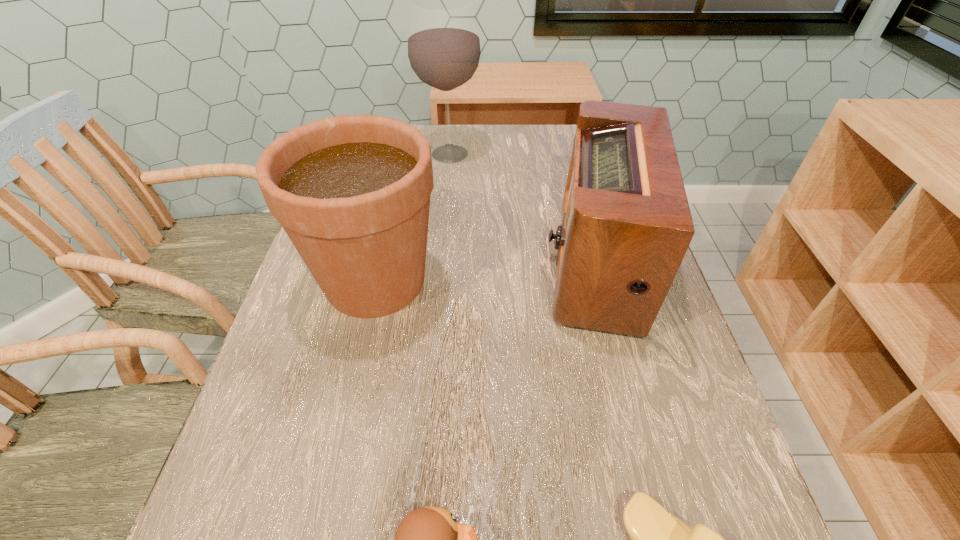
The width and height of the screenshot is (960, 540). I want to click on the farthest object, so click(443, 47).

You are a GUI agent. You are given a task and a screenshot of the screen. Output one action in this format:
    pyautogui.click(x=<x>, y=<y>)
    Task: Click on the alcohol
    The width and height of the screenshot is (960, 540).
    Given the screenshot: What is the action you would take?
    pyautogui.click(x=443, y=47)

You are a GUI agent. You are given a task and a screenshot of the screen. Output one action in this format:
    pyautogui.click(x=<x>, y=<y>)
    Task: Click on the flowerpot
    Image resolution: width=960 pixels, height=540 pixels.
    Given the screenshot: What is the action you would take?
    pyautogui.click(x=352, y=192)

Image resolution: width=960 pixels, height=540 pixels. Find the location of `radio receiver`. radio receiver is located at coordinates (626, 225).

Identify the location of vacant area situated 0.140m on the front of the farthest object. The width and height of the screenshot is (960, 540). (445, 201).

Locate an element on the screen. Image resolution: width=960 pixels, height=540 pixels. free space located 0.180m on the right of the flowerpot is located at coordinates (526, 281).

Locate an element on the screen. The height and width of the screenshot is (540, 960). vacant space located 0.300m on the front of the radio receiver is located at coordinates (667, 516).

Find the location of `object that is at the far edge`. object that is at the far edge is located at coordinates (443, 47).

Locate an element on the screen. This screenshot has height=540, width=960. object present at the left edge is located at coordinates (352, 192).

Where is `object that is at the right edge`? object that is at the right edge is located at coordinates (626, 225).